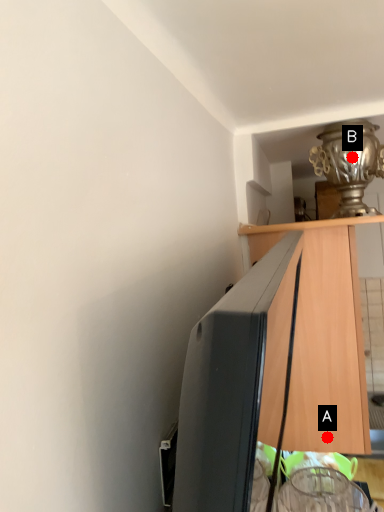
Question: Two points are circled on the image, labeled by A and B beside each circle. Which point appears closest to the camera in this image?

Choices:
 (A) A is closer
 (B) B is closer

Answer: (B)